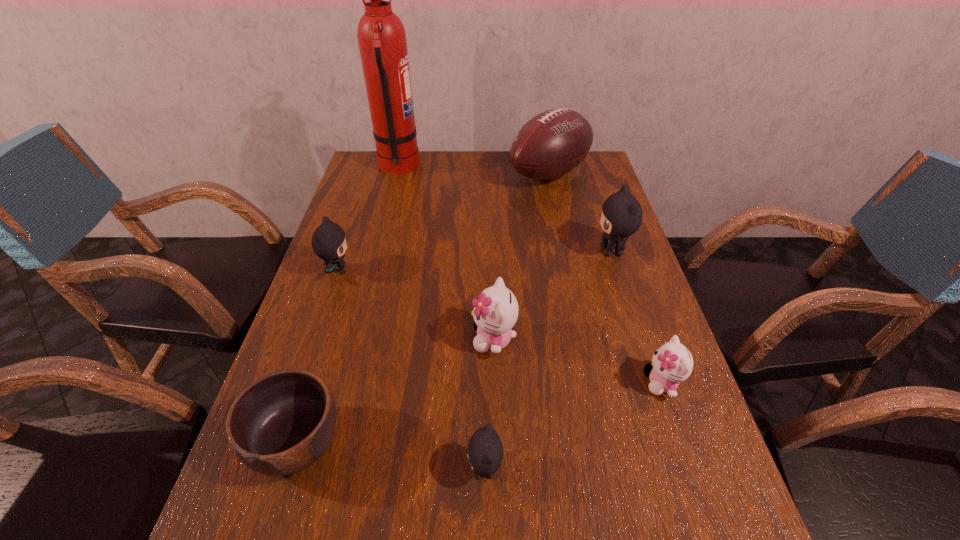
I want to click on vacant space that's between the smaller white kitten and the biggest gray kitten, so click(636, 316).

The image size is (960, 540). I want to click on free space between the bigger white kitten and the second biggest gray kitten, so click(x=416, y=304).

Locate an element on the screen. Image resolution: width=960 pixels, height=540 pixels. vacant space that's between the rightmost gray kitten and the left white kitten is located at coordinates [553, 295].

This screenshot has height=540, width=960. In order to click on vacant area that lies between the tallest object and the right white kitten in this screenshot , I will do `click(530, 275)`.

The width and height of the screenshot is (960, 540). What are the coordinates of `unoccupied area between the right white kitten and the biggest gray kitten` in the screenshot? It's located at (636, 316).

The image size is (960, 540). What are the coordinates of `vacant space in between the football (American) and the fire extinguisher` in the screenshot? It's located at (473, 171).

You are a GUI agent. You are given a task and a screenshot of the screen. Output one action in this format:
    pyautogui.click(x=<x>, y=<y>)
    Task: Click on the unoccupied area between the nearest kitten and the tallest object
    The height and width of the screenshot is (540, 960).
    Given the screenshot: What is the action you would take?
    pyautogui.click(x=442, y=318)

Identify which object is the seventh nearest to the leftmost kitten. Please provide its 2D coordinates. Your answer should be formatted as a tuple, i.e. [(x, y)], where the tuple contains the x and y coordinates of a point satisfying the conditions above.

[(672, 363)]

Identify which object is the second nearest to the football (American). Please provide its 2D coordinates. Your answer should be formatted as a tuple, i.e. [(x, y)], where the tuple contains the x and y coordinates of a point satisfying the conditions above.

[(381, 36)]

Locate an element on the screen. The height and width of the screenshot is (540, 960). kitten that can be found as the second closest to the smaller white kitten is located at coordinates (621, 216).